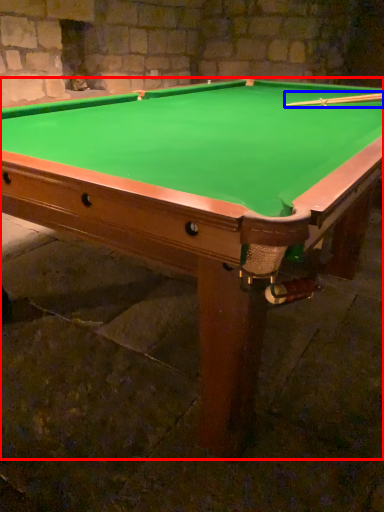
Question: Which point is further to the camera, billiard table (highlighted by a red box) or cue (highlighted by a blue box)?

Choices:
 (A) billiard table
 (B) cue

Answer: (B)